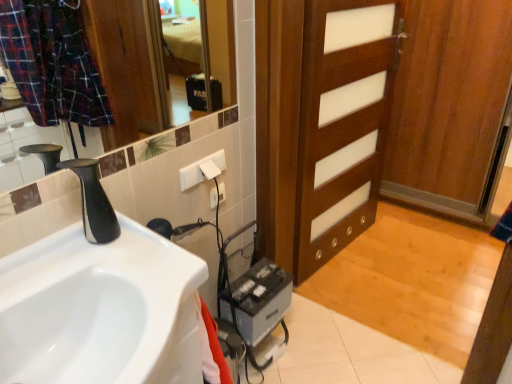
Question: From a real-world perspective, relative to black matte faucet at left, is white glossy sink at lower left vertically above or below?

Choices:
 (A) above
 (B) below

Answer: (B)

Question: Visually, is white glossy sink at lower left positioned to the left or to the right of black matte faucet at left?

Choices:
 (A) right
 (B) left

Answer: (A)

Question: Based on their relative distances, which object is farther from the white plastic electric outlet at upper center, the first electric outlet positioned from the front?

Choices:
 (A) white plastic electric outlet at upper center, which appears as the second electric outlet when viewed from the front
 (B) wooden door at center
 (C) gray metallic battery at lower center
 (D) black matte faucet at left
 (E) white glossy sink at lower left

Answer: (B)

Question: Considering the real-world distances, which object is farthest from the wooden door at center?

Choices:
 (A) white plastic electric outlet at upper center, the second electric outlet from the back
 (B) white glossy sink at lower left
 (C) gray metallic battery at lower center
 (D) black matte faucet at left
 (E) white plastic electric outlet at upper center, marked as the 1th electric outlet in a back-to-front arrangement

Answer: (D)